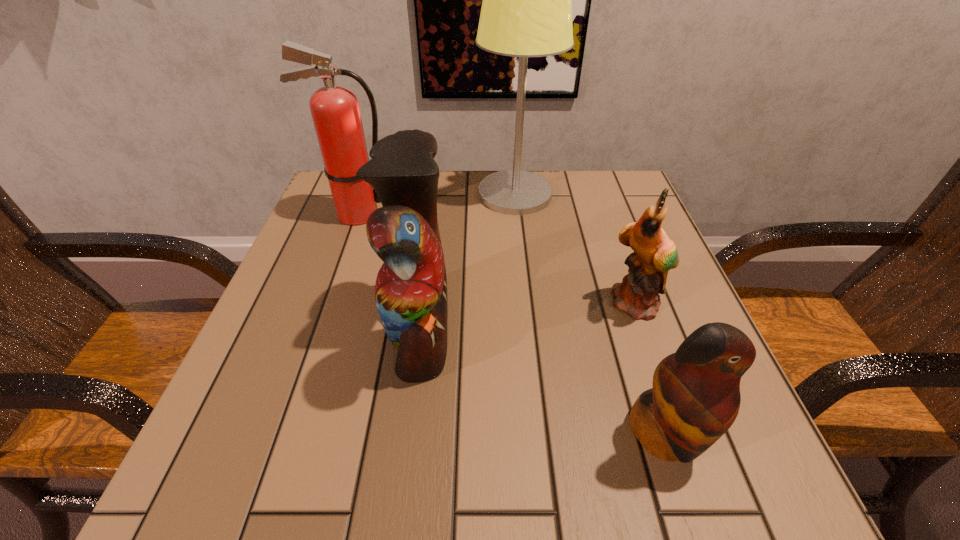
Locate an element on the screen. fire extinguisher at the far edge is located at coordinates (335, 111).

Identify the location of object at the near edge. The height and width of the screenshot is (540, 960). (695, 398).

The height and width of the screenshot is (540, 960). Identify the location of object located in the left edge section of the desktop. (335, 111).

You are a GUI agent. You are given a task and a screenshot of the screen. Output one action in this format:
    pyautogui.click(x=<x>, y=<y>)
    Task: Click on the object that is at the far left corner
    
    Given the screenshot: What is the action you would take?
    pyautogui.click(x=335, y=111)

Locate an element on the screen. This screenshot has width=960, height=540. object situated at the near right corner is located at coordinates (695, 398).

In the image, there is a desktop. Where is `vacant space at the near edge`? The width and height of the screenshot is (960, 540). vacant space at the near edge is located at coordinates [589, 483].

This screenshot has width=960, height=540. What are the coordinates of `free space at the left edge of the desktop` in the screenshot? It's located at (337, 234).

In the image, there is a desktop. Find the location of `vacant space at the right edge`. vacant space at the right edge is located at coordinates (589, 232).

In the image, there is a desktop. Where is `vacant space at the far left corner`? The image size is (960, 540). vacant space at the far left corner is located at coordinates (324, 208).

At what (x,y) coordinates should I click in order to perform the action: click on vacant space at the near left corner of the desktop. Please return your answer as a coordinate pair (x, y). Looking at the image, I should click on (296, 447).